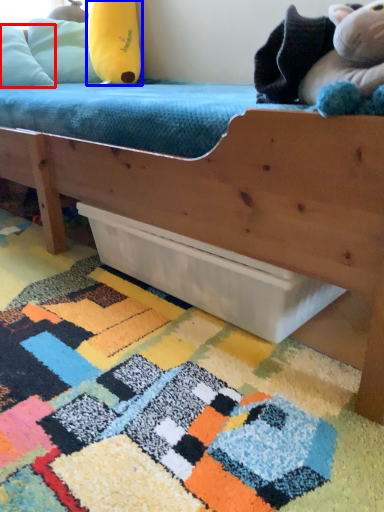
Question: Which of the following is the farthest to the observer, pillow (highlighted by a red box) or toy (highlighted by a blue box)?

Choices:
 (A) pillow
 (B) toy

Answer: (B)